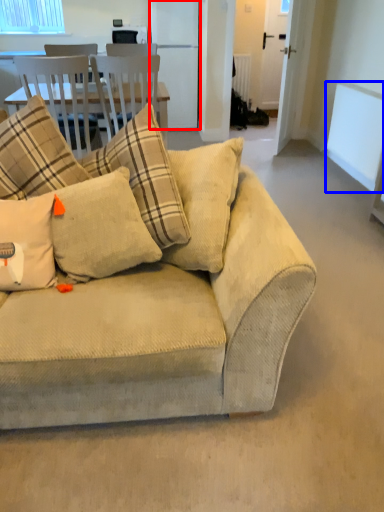
Question: Which of the following is the closest to the observer, appliance (highlighted by a red box) or window screen (highlighted by a blue box)?

Choices:
 (A) appliance
 (B) window screen

Answer: (B)